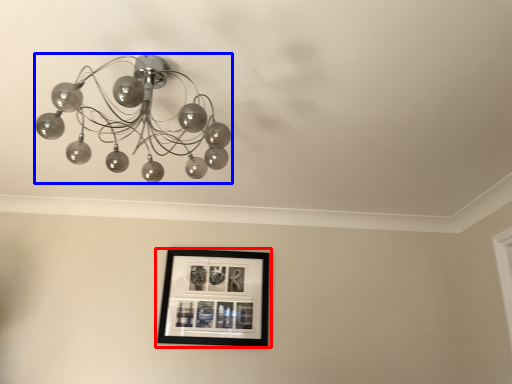
Question: Which object appears farthest to the camera in this image, picture frame (highlighted by a red box) or lamp (highlighted by a blue box)?

Choices:
 (A) picture frame
 (B) lamp

Answer: (A)